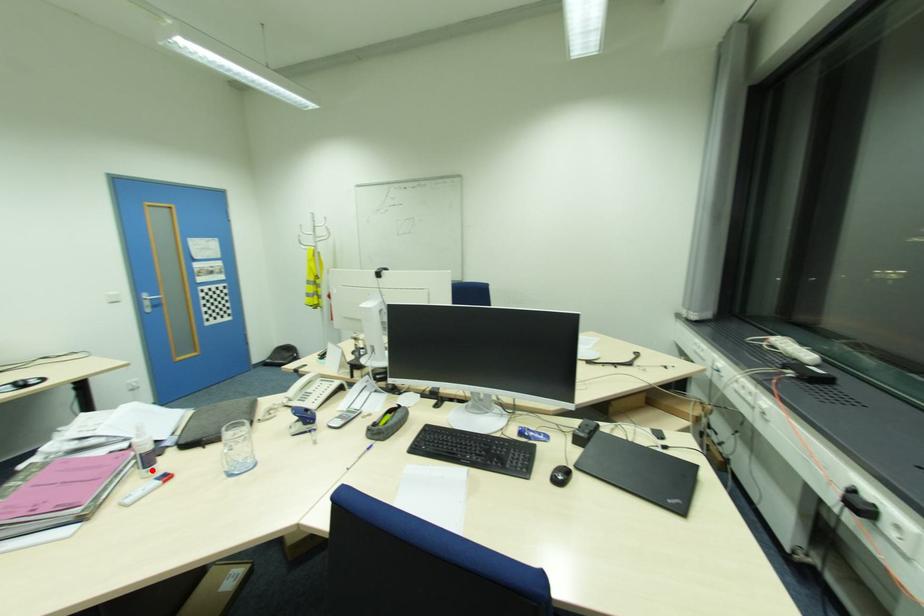
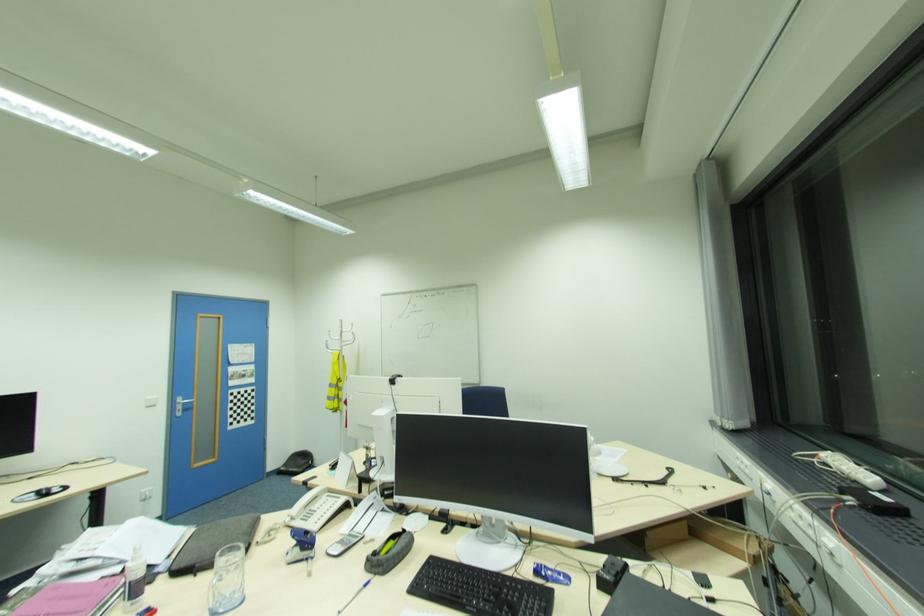
Locate, in the second image, the point that corresponds to the highlighted location in the first image.

(136, 604)